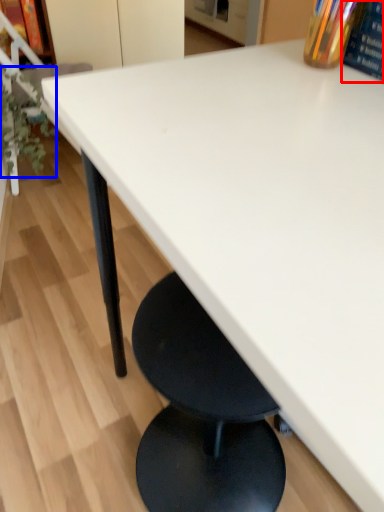
Question: Which point is further to the camera, paperback book (highlighted by a red box) or plant (highlighted by a blue box)?

Choices:
 (A) paperback book
 (B) plant

Answer: (B)